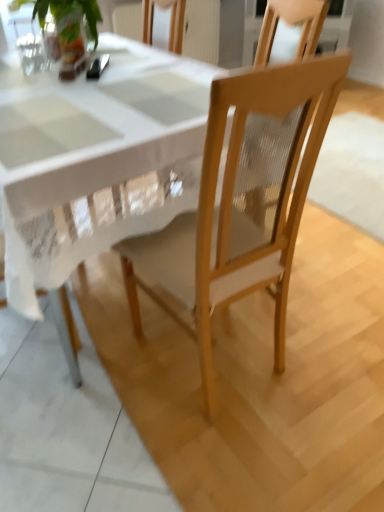
Question: Does green leafy plant at upper left have a larger size compared to light wood chair at center?

Choices:
 (A) no
 (B) yes

Answer: (A)

Question: Can you confirm if green leafy plant at upper left is wider than light wood chair at center?

Choices:
 (A) no
 (B) yes

Answer: (A)

Question: Is green leafy plant at upper left not near light wood chair at center?

Choices:
 (A) no
 (B) yes

Answer: (A)

Question: Could light wood chair at center be considered to be inside green leafy plant at upper left?

Choices:
 (A) yes
 (B) no

Answer: (B)

Question: Is green leafy plant at upper left positioned behind light wood chair at center?

Choices:
 (A) yes
 (B) no

Answer: (A)

Question: From a real-world perspective, relative to green leafy plant at upper left, is white glossy table at center vertically above or below?

Choices:
 (A) above
 (B) below

Answer: (B)

Question: In terms of width, does white glossy table at center look wider or thinner when compared to green leafy plant at upper left?

Choices:
 (A) thin
 (B) wide

Answer: (B)

Question: Is white glossy table at center bigger or smaller than green leafy plant at upper left?

Choices:
 (A) small
 (B) big

Answer: (B)

Question: In terms of height, does white glossy table at center look taller or shorter compared to green leafy plant at upper left?

Choices:
 (A) short
 (B) tall

Answer: (B)

Question: From the image's perspective, relative to green leafy plant at upper left, is metallic silver spoon at upper left above or below?

Choices:
 (A) below
 (B) above

Answer: (A)

Question: Relative to green leafy plant at upper left, is metallic silver spoon at upper left in front or behind?

Choices:
 (A) front
 (B) behind

Answer: (B)

Question: From a real-world perspective, relative to green leafy plant at upper left, is metallic silver spoon at upper left vertically above or below?

Choices:
 (A) below
 (B) above

Answer: (A)

Question: In terms of width, does metallic silver spoon at upper left look wider or thinner when compared to green leafy plant at upper left?

Choices:
 (A) thin
 (B) wide

Answer: (A)

Question: Would you say green leafy plant at upper left is inside or outside light wood chair at center?

Choices:
 (A) inside
 (B) outside

Answer: (B)

Question: Is green leafy plant at upper left wider or thinner than light wood chair at center?

Choices:
 (A) wide
 (B) thin

Answer: (B)